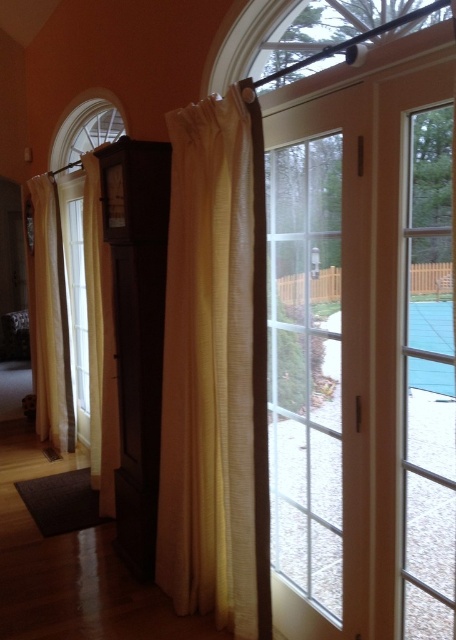
You are standing in the room and want to exit through the clear glass door at right. However, there is a beige textured curtain at left in your way. Can you walk directly to the door without moving the curtain?

The clear glass door at right is in front of the beige textured curtain at left, so you can walk directly to the door without needing to move the curtain since the door is in front of the curtain.

You are trying to exit through the clear glass door at right, but it is blocked by an object. Based on their sizes, which object could potentially block the door? The light beige sheer curtain at left is larger than the door. Could the curtain be the one blocking it?

The clear glass door at right is smaller than the light beige sheer curtain at left, so the curtain could potentially block the door since it is larger.

You are arranging flowers in a vase and need to place them between the yellow sheer curtain at center and the light beige sheer curtain at left. Which curtain should you place the vase closer to if you want it to be nearer to the left wall?

The light beige sheer curtain at left is on the left side of the yellow sheer curtain at center. To place the vase closer to the left wall, position it near the light beige sheer curtain at left.